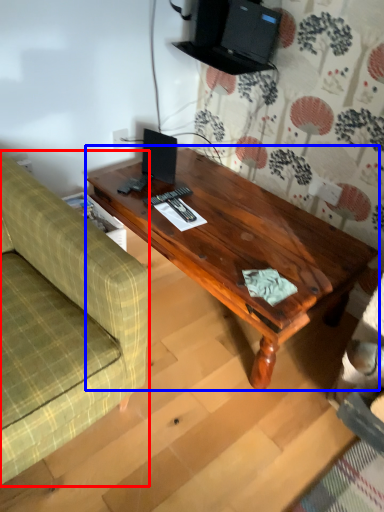
Question: Which point is closer to the camera, studio couch (highlighted by a red box) or coffee table (highlighted by a blue box)?

Choices:
 (A) studio couch
 (B) coffee table

Answer: (A)